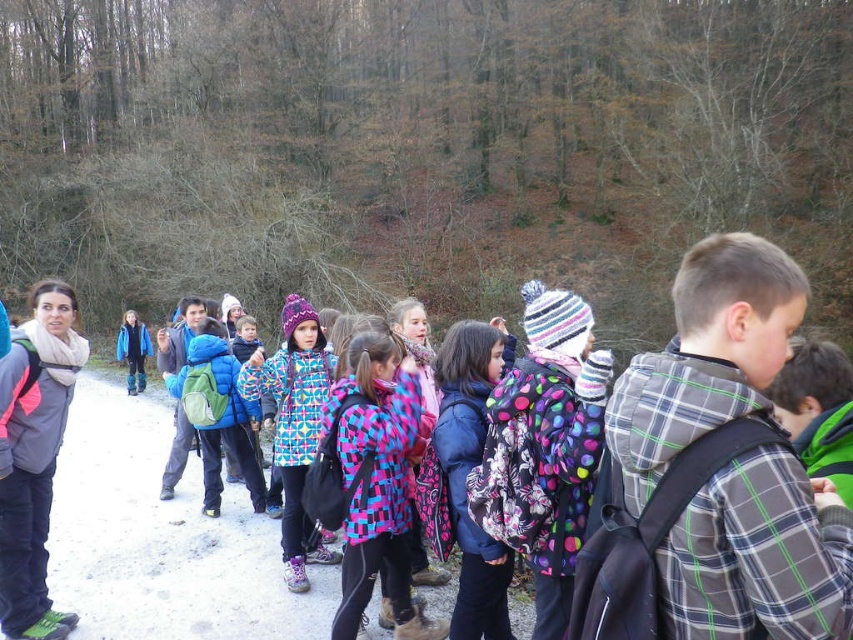
You are a photographer trying to capture a photo of the matte gray jacket at left and the polka dot scarf at center. Which object should you focus on first if you want to include both in your frame without moving the camera?

You should focus on the matte gray jacket at left first because it is positioned to the left of the polka dot scarf at center, so capturing it first ensures both are within the frame.

You are a photographer trying to capture a photo of the plaid fabric jacket at right and the polka dot scarf at center. Which object should you zoom in on to make them appear the same size in the photo?

The plaid fabric jacket at right is smaller than the polka dot scarf at center, so you should zoom in on the plaid fabric jacket at right to make them appear the same size in the photo.

You are a photographer trying to capture a photo of the matte gray jacket at left and the polka dot scarf at center. Which object should you zoom in on to ensure both are clearly visible in the frame?

The matte gray jacket at left occupies less space than the polka dot scarf at center, so you should zoom in on the polka dot scarf at center to ensure both are clearly visible in the frame.